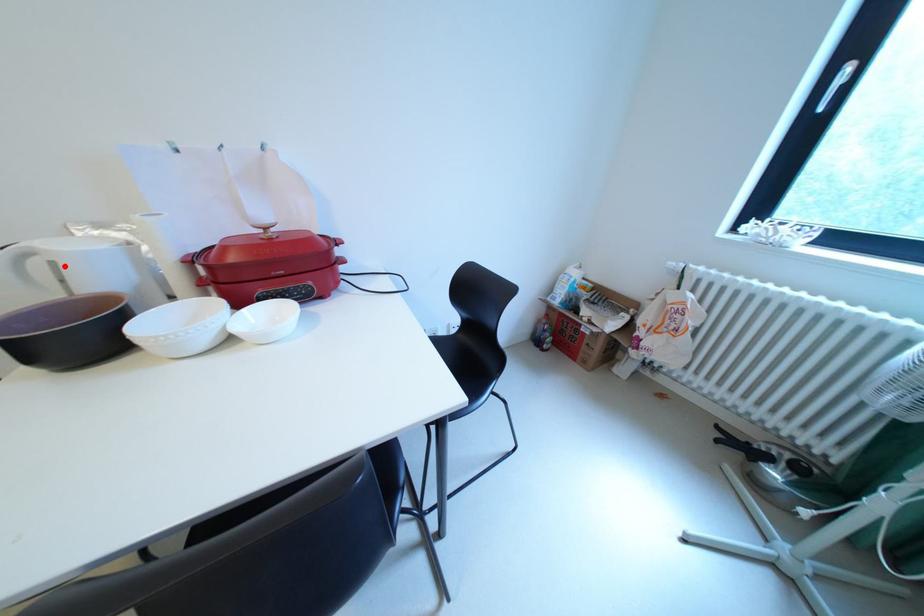
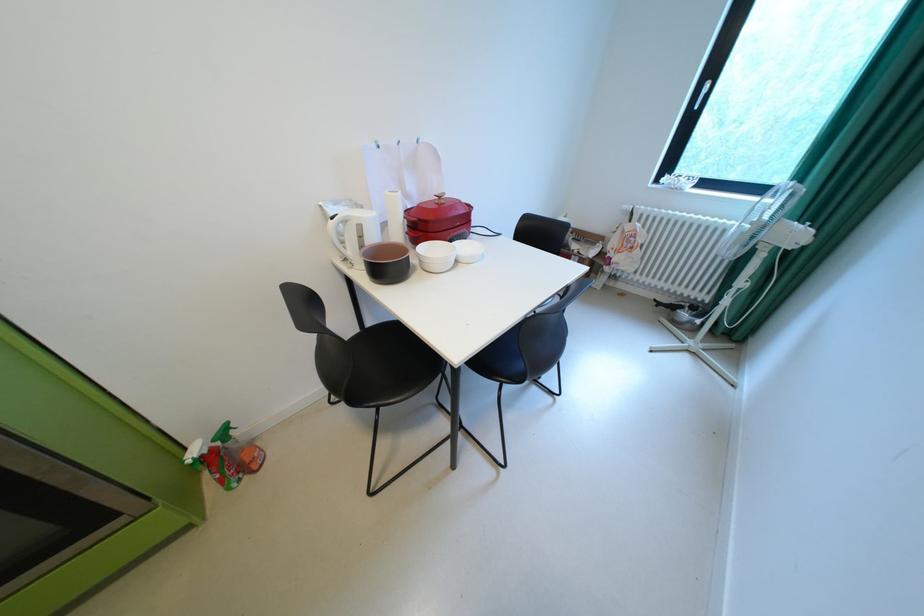
Find the pixel in the second image that matches the highlighted location in the first image.

(370, 227)